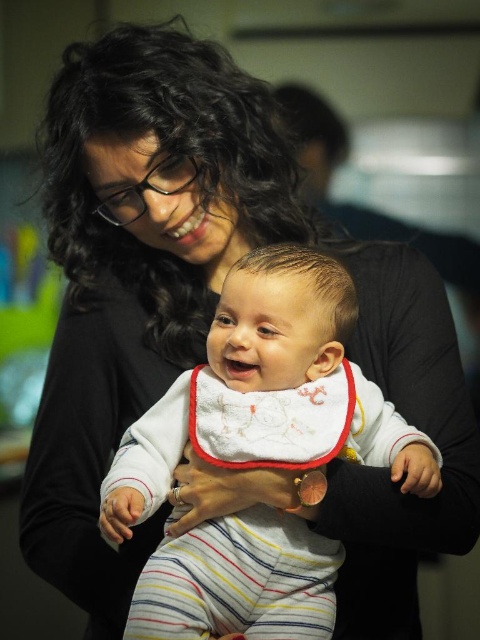
Question: Among these objects, which one is farthest from the camera?

Choices:
 (A) white embroidered bib at center
 (B) white soft fabric baby at center

Answer: (A)

Question: Observing the image, what is the correct spatial positioning of white soft fabric baby at center in reference to white embroidered bib at center?

Choices:
 (A) below
 (B) above

Answer: (A)

Question: Does white soft fabric baby at center have a lesser width compared to white embroidered bib at center?

Choices:
 (A) yes
 (B) no

Answer: (B)

Question: Can you confirm if white soft fabric baby at center is positioned above white embroidered bib at center?

Choices:
 (A) no
 (B) yes

Answer: (A)